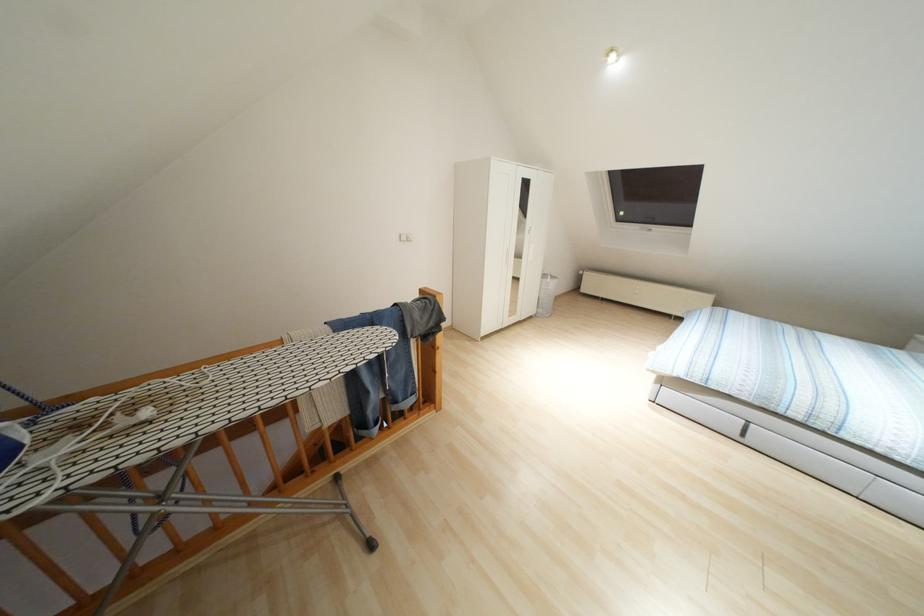
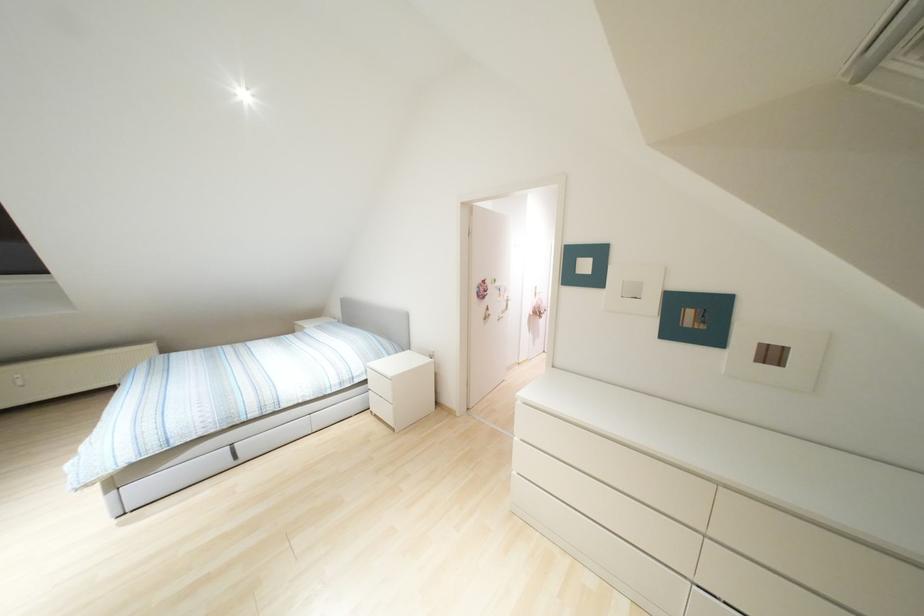
The point at [743,435] is marked in the first image. Where is the corresponding point in the second image?

(235, 456)